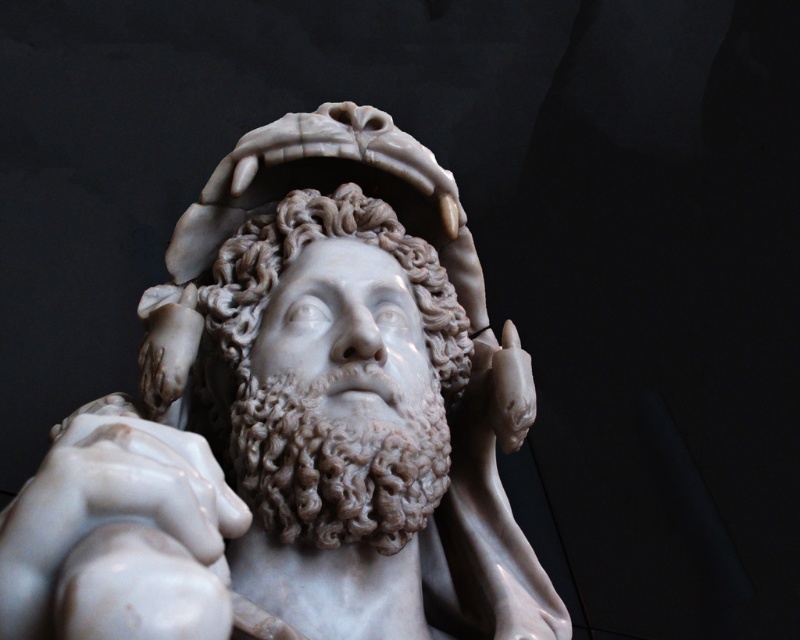
Based on the photo, how distant is white marble statue at center from white marble head at center?

They are 31.82 inches apart.

Measure the distance between white marble statue at center and white marble head at center.

The distance of white marble statue at center from white marble head at center is 31.82 inches.

Locate an element on the screen. The image size is (800, 640). white marble statue at center is located at coordinates 296,420.